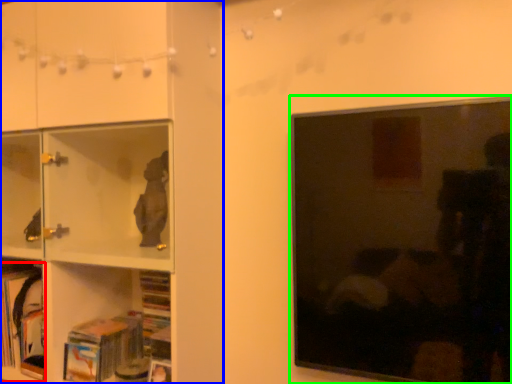
Question: Which object is the closest to the book (highlighted by a red box)? Choose among these: shelf (highlighted by a blue box) or picture frame (highlighted by a green box).

Choices:
 (A) shelf
 (B) picture frame

Answer: (A)